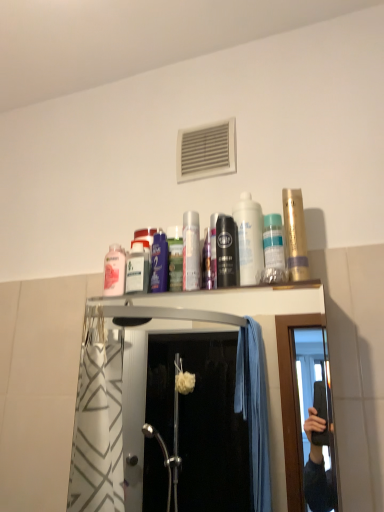
Question: Can you confirm if black matte mouthwash at center, acting as the 4th mouthwash starting from the right, is positioned to the right of metallic silver mouthwash at center, positioned as the 3th mouthwash in left-to-right order?

Choices:
 (A) no
 (B) yes

Answer: (B)

Question: Can you confirm if black matte mouthwash at center, the fourth mouthwash positioned from the left, is taller than metallic silver mouthwash at center, which appears as the fifth mouthwash when viewed from the right?

Choices:
 (A) no
 (B) yes

Answer: (A)

Question: Is black matte mouthwash at center, acting as the 4th mouthwash starting from the right, smaller than metallic silver mouthwash at center, which appears as the fifth mouthwash when viewed from the right?

Choices:
 (A) no
 (B) yes

Answer: (B)

Question: Can you confirm if black matte mouthwash at center, the fourth mouthwash positioned from the left, is shorter than metallic silver mouthwash at center, positioned as the 3th mouthwash in left-to-right order?

Choices:
 (A) no
 (B) yes

Answer: (B)

Question: Can you confirm if black matte mouthwash at center, the fourth mouthwash positioned from the left, is positioned to the left of metallic silver mouthwash at center, positioned as the 3th mouthwash in left-to-right order?

Choices:
 (A) no
 (B) yes

Answer: (A)

Question: Is black matte mouthwash at center, the fourth mouthwash positioned from the left, not within metallic silver mouthwash at center, positioned as the 3th mouthwash in left-to-right order?

Choices:
 (A) no
 (B) yes

Answer: (B)

Question: From a real-world perspective, is metallic silver mouthwash at center, positioned as the 3th mouthwash in left-to-right order, on top of metallic silver can at center, the second mouthwash viewed from the left?

Choices:
 (A) yes
 (B) no

Answer: (A)

Question: From the image's perspective, would you say metallic silver mouthwash at center, which appears as the fifth mouthwash when viewed from the right, is shown under metallic silver can at center, the 6th mouthwash when ordered from right to left?

Choices:
 (A) yes
 (B) no

Answer: (B)

Question: Is the position of metallic silver mouthwash at center, which appears as the fifth mouthwash when viewed from the right, more distant than that of metallic silver can at center, the 6th mouthwash when ordered from right to left?

Choices:
 (A) no
 (B) yes

Answer: (B)

Question: Is metallic silver can at center, the second mouthwash viewed from the left, inside metallic silver mouthwash at center, which appears as the fifth mouthwash when viewed from the right?

Choices:
 (A) yes
 (B) no

Answer: (B)

Question: From a real-world perspective, is metallic silver mouthwash at center, which appears as the fifth mouthwash when viewed from the right, under metallic silver can at center, the second mouthwash viewed from the left?

Choices:
 (A) yes
 (B) no

Answer: (B)

Question: Does metallic silver mouthwash at center, which appears as the fifth mouthwash when viewed from the right, appear on the right side of metallic silver can at center, the second mouthwash viewed from the left?

Choices:
 (A) yes
 (B) no

Answer: (A)

Question: Considering the relative sizes of metallic silver can at center, the second mouthwash viewed from the left, and black matte mouthwash at center, acting as the 4th mouthwash starting from the right, in the image provided, is metallic silver can at center, the second mouthwash viewed from the left, taller than black matte mouthwash at center, acting as the 4th mouthwash starting from the right,?

Choices:
 (A) no
 (B) yes

Answer: (B)